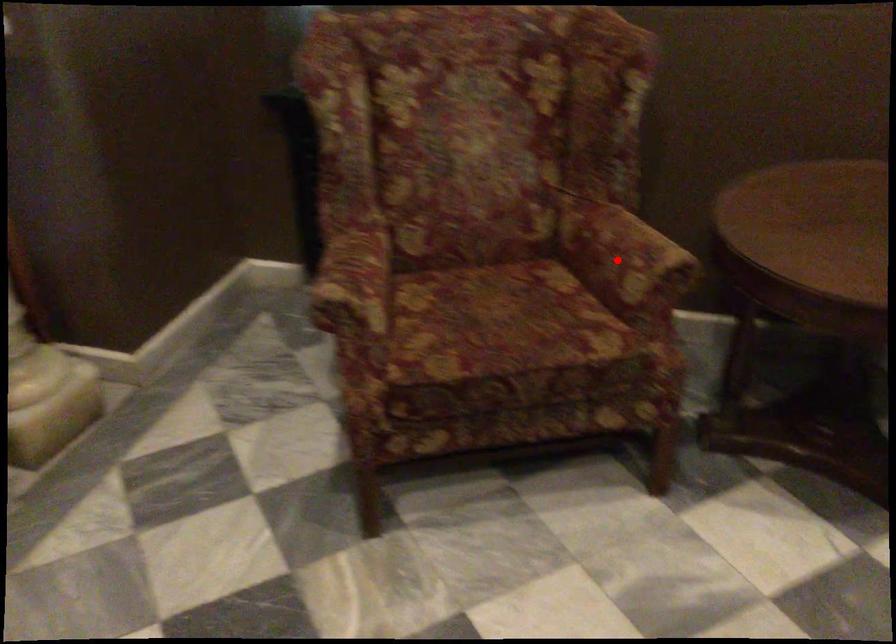
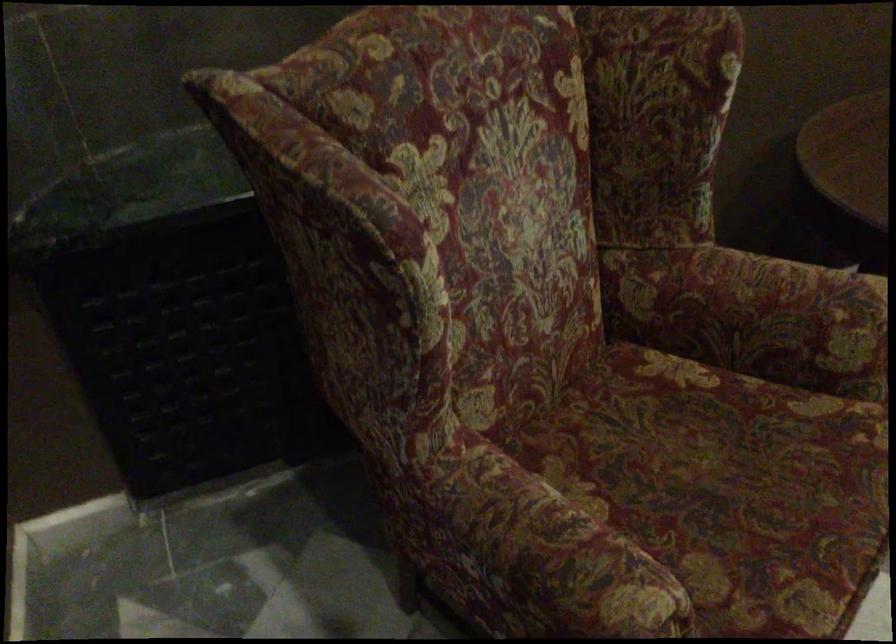
In the second image, find the point that corresponds to the highlighted location in the first image.

(786, 321)